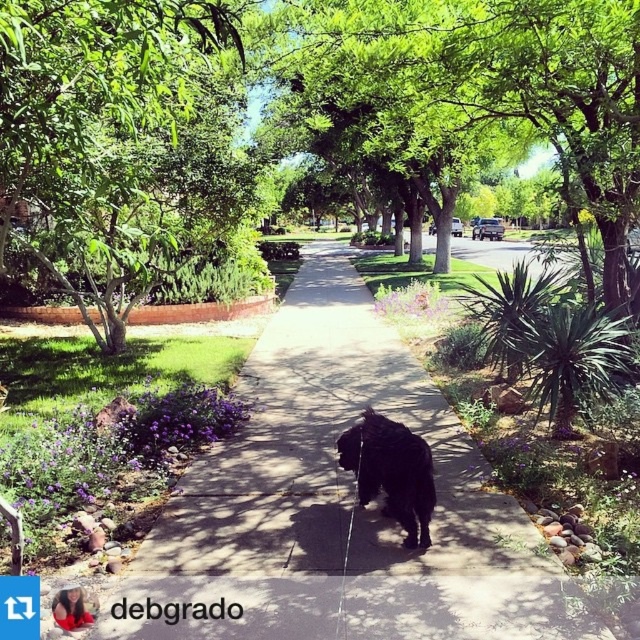
You are standing at the point labeled as point (106, 134) in the suburban scene. What object are you currently standing on?

The point (106, 134) is on the green leafy tree at upper left, so you are standing on the green leafy tree at upper left.

You are a photographer standing on the sidewalk and want to take a photo of the black fur dog at center without including the green leafy tree at upper left in the frame. Which direction should you move to achieve this?

The green leafy tree at upper left is located above the black fur dog at center. To exclude the tree from the frame while keeping the dog centered, move to the right side of the dog so the tree is no longer in the upper left of your view.

You are a gardener planning to plant a new tree in the suburban area shown. The smooth concrete sidewalk at center and the green leafy tree at center are already present. Considering their sizes, which object would require more space for planting and maintenance?

The green leafy tree at center requires more space for planting and maintenance because it is larger than the smooth concrete sidewalk at center.